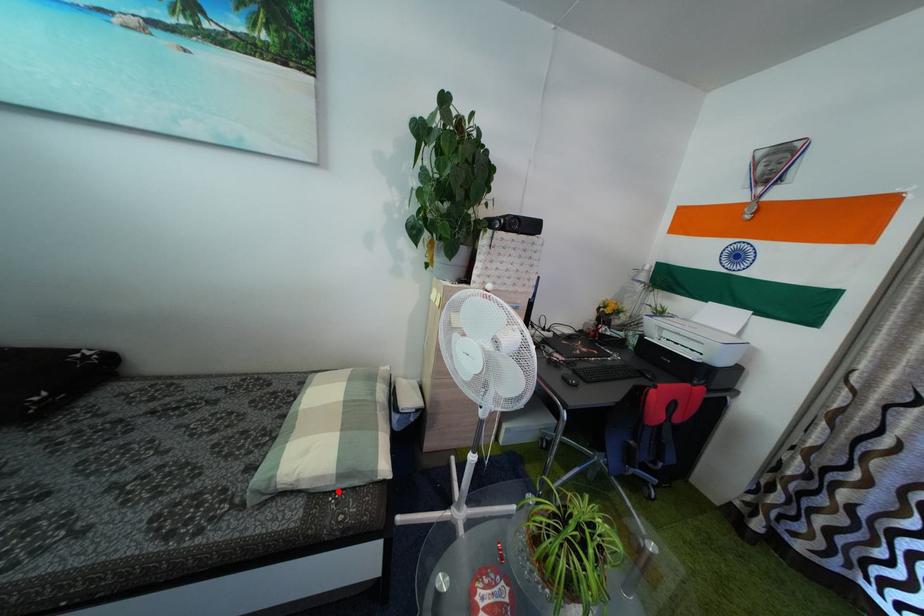
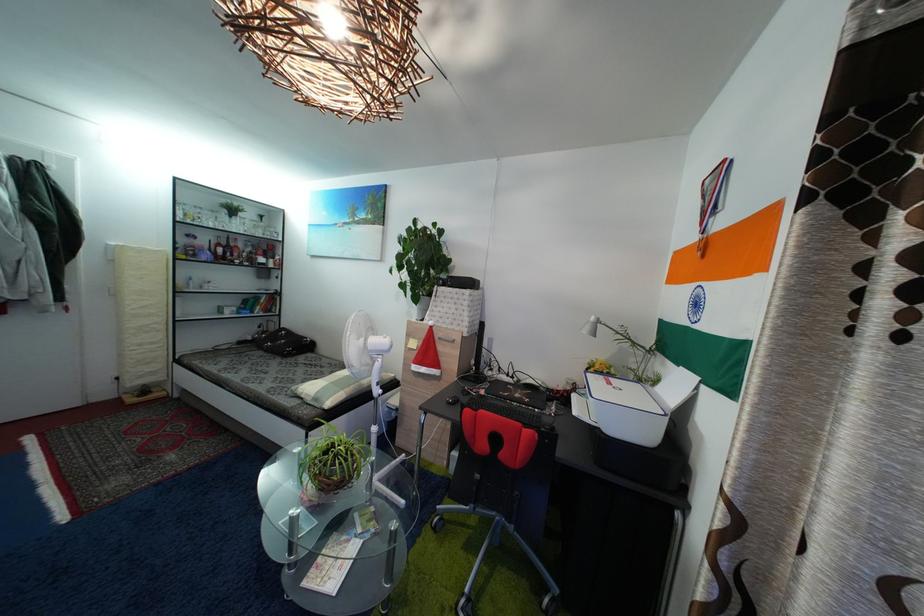
Locate, in the second image, the point that corresponds to the highlighted location in the first image.

(318, 407)